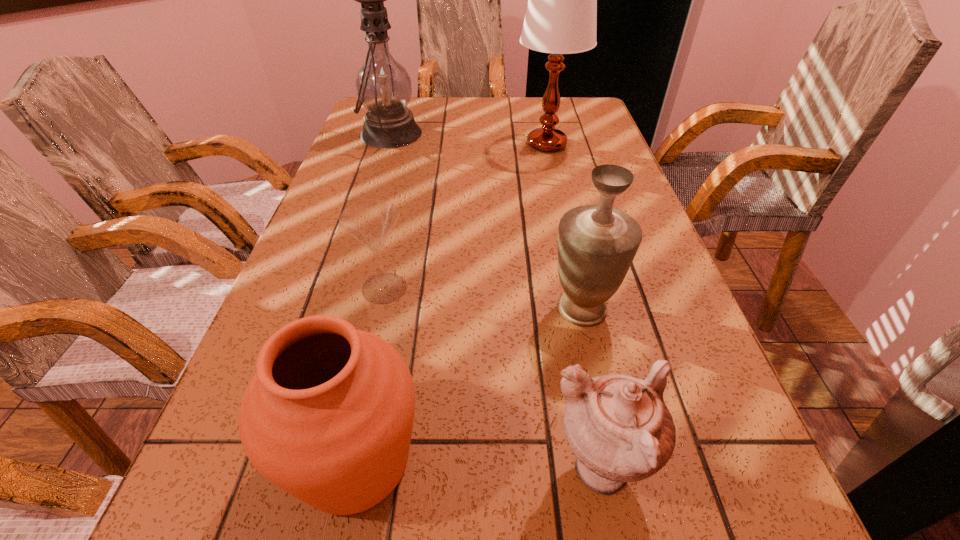
Identify which urn is located as the nearest to the shortest object. Please provide its 2D coordinates. Your answer should be formatted as a tuple, i.e. [(x, y)], where the tuple contains the x and y coordinates of a point satisfying the conditions above.

[(328, 416)]

Where is `free location that satisfies the following two spatial constraints: 1. on the front side of the shortest object; 2. on the right side of the farthest urn`? Image resolution: width=960 pixels, height=540 pixels. free location that satisfies the following two spatial constraints: 1. on the front side of the shortest object; 2. on the right side of the farthest urn is located at coordinates (380, 309).

Image resolution: width=960 pixels, height=540 pixels. What are the coordinates of `blank area in the image that satisfies the following two spatial constraints: 1. on the back side of the table lamp; 2. on the left side of the leftmost urn` in the screenshot? It's located at [x=420, y=144].

You are a GUI agent. You are given a task and a screenshot of the screen. Output one action in this format:
    pyautogui.click(x=<x>, y=<y>)
    Task: Click on the vacant area in the image that satisfies the following two spatial constraints: 1. on the front side of the table lamp; 2. on the left side of the oil lamp
    The height and width of the screenshot is (540, 960).
    Given the screenshot: What is the action you would take?
    pyautogui.click(x=388, y=144)

Where is `free location that satisfies the following two spatial constraints: 1. on the back side of the table lamp; 2. on the left side of the shortest urn`? The height and width of the screenshot is (540, 960). free location that satisfies the following two spatial constraints: 1. on the back side of the table lamp; 2. on the left side of the shortest urn is located at coordinates (536, 144).